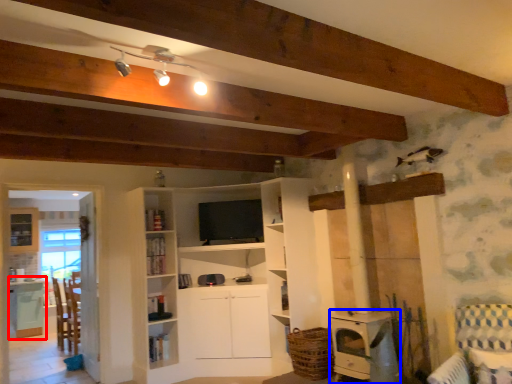
Question: Among these objects, which one is nearest to the camera, table (highlighted by a red box) or appliance (highlighted by a blue box)?

Choices:
 (A) table
 (B) appliance

Answer: (B)